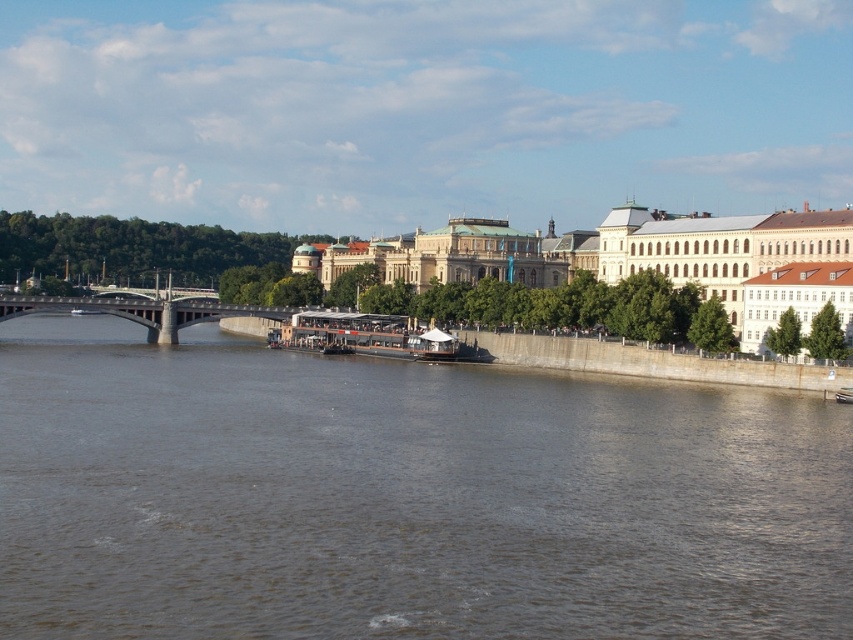
Question: Among these objects, which one is farthest from the camera?

Choices:
 (A) brown water at center
 (B) concrete bridge at left
 (C) wooden polished boat at center

Answer: (B)

Question: Can you confirm if wooden polished boat at center is positioned above concrete bridge at left?

Choices:
 (A) no
 (B) yes

Answer: (A)

Question: Estimate the real-world distances between objects in this image. Which object is closer to the concrete bridge at left?

Choices:
 (A) brown water at center
 (B) wooden polished boat at center

Answer: (B)

Question: Can you confirm if wooden polished boat at center is wider than concrete bridge at left?

Choices:
 (A) no
 (B) yes

Answer: (A)

Question: Which point appears closest to the camera in this image?

Choices:
 (A) (198, 316)
 (B) (312, 324)

Answer: (B)

Question: Does brown water at center appear over wooden polished boat at center?

Choices:
 (A) yes
 (B) no

Answer: (B)